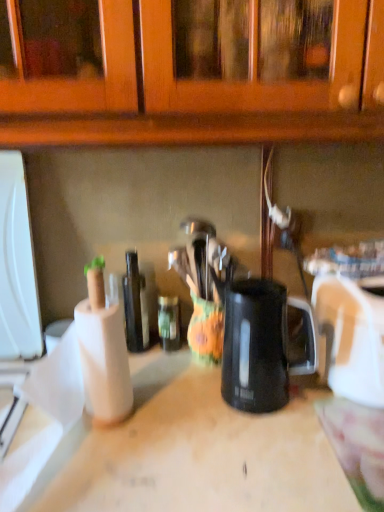
Identify the location of vacant space in front of black plastic mug at center. (276, 457).